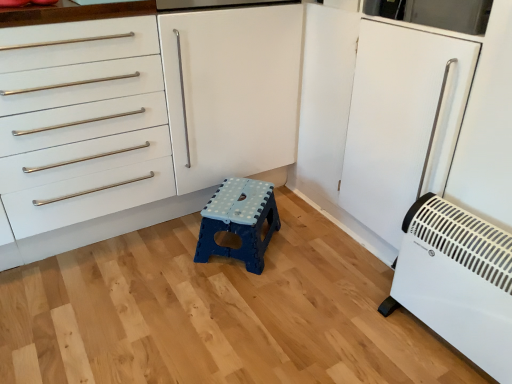
Locate an element on the screen. vacant space to the left of white plastic heater at lower right is located at coordinates (360, 337).